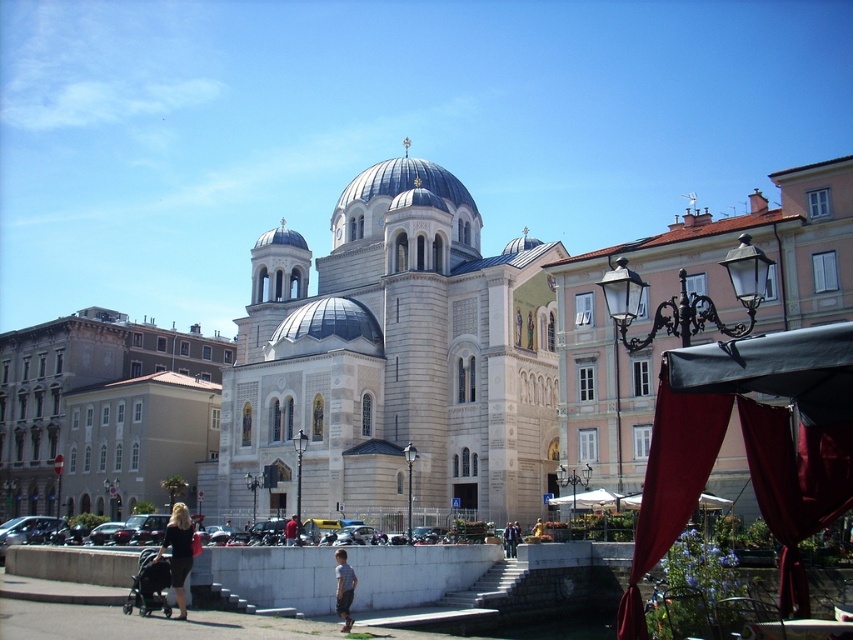
Based on the photo, is matte stone church at center to the right of black fabric dress at lower left from the viewer's perspective?

Correct, you'll find matte stone church at center to the right of black fabric dress at lower left.

Describe the element at coordinates (693, 292) in the screenshot. I see `matte stone church at center` at that location.

At what (x,y) coordinates should I click in order to perform the action: click on matte stone church at center. Please return your answer as a coordinate pair (x, y). The width and height of the screenshot is (853, 640). Looking at the image, I should click on (693, 292).

Locate an element on the screen. white stone church at center is located at coordinates (393, 362).

Can you confirm if white stone church at center is positioned to the left of black fabric canopy at right?

Yes, white stone church at center is to the left of black fabric canopy at right.

Image resolution: width=853 pixels, height=640 pixels. What do you see at coordinates (393, 362) in the screenshot?
I see `white stone church at center` at bounding box center [393, 362].

Find the location of a particular element. white stone church at center is located at coordinates (393, 362).

Can you confirm if black fabric dress at lower left is smaller than red fabric shirt at center?

Incorrect, black fabric dress at lower left is not smaller in size than red fabric shirt at center.

Is black fabric dress at lower left shorter than red fabric shirt at center?

No.

Which is behind, point (173, 548) or point (293, 538)?

Positioned behind is point (293, 538).

Locate an element on the screen. black fabric dress at lower left is located at coordinates (178, 552).